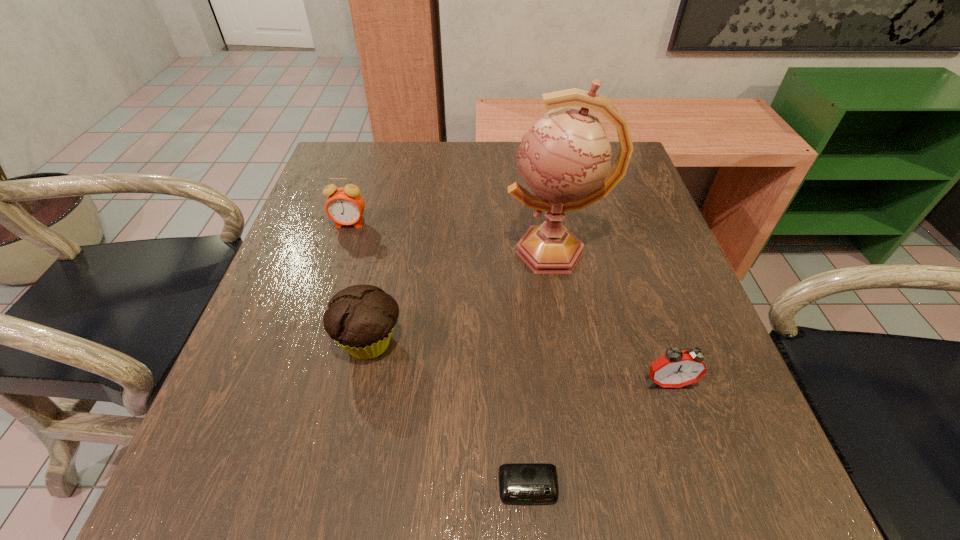
Identify the location of free space that is in between the muffin and the globe. (462, 297).

At what (x,y) coordinates should I click in order to perform the action: click on free space between the second object from left to right and the leftmost object. Please return your answer as a coordinate pair (x, y). Looking at the image, I should click on (360, 284).

In order to click on vacant point located between the nearest object and the second nearest alarm clock in this screenshot , I will do `click(598, 435)`.

Where is `free space that is in between the shortest object and the tallest object`? The width and height of the screenshot is (960, 540). free space that is in between the shortest object and the tallest object is located at coordinates (541, 369).

Where is `free space between the second nearest object and the leftmost object`? The width and height of the screenshot is (960, 540). free space between the second nearest object and the leftmost object is located at coordinates (509, 303).

This screenshot has height=540, width=960. What are the coordinates of `vacant space in between the globe and the nearest alarm clock` in the screenshot? It's located at (541, 369).

Locate an element on the screen. This screenshot has width=960, height=540. object that stands as the closest to the globe is located at coordinates (360, 318).

I want to click on the third closest object to the second tallest alarm clock, so click(x=360, y=318).

Point out which alarm clock is positioned as the nearest to the nearest alarm clock. Please provide its 2D coordinates. Your answer should be formatted as a tuple, i.e. [(x, y)], where the tuple contains the x and y coordinates of a point satisfying the conditions above.

[(675, 369)]

Locate an element on the screen. This screenshot has height=540, width=960. alarm clock that is the second closest one to the fourth farthest object is located at coordinates (345, 206).